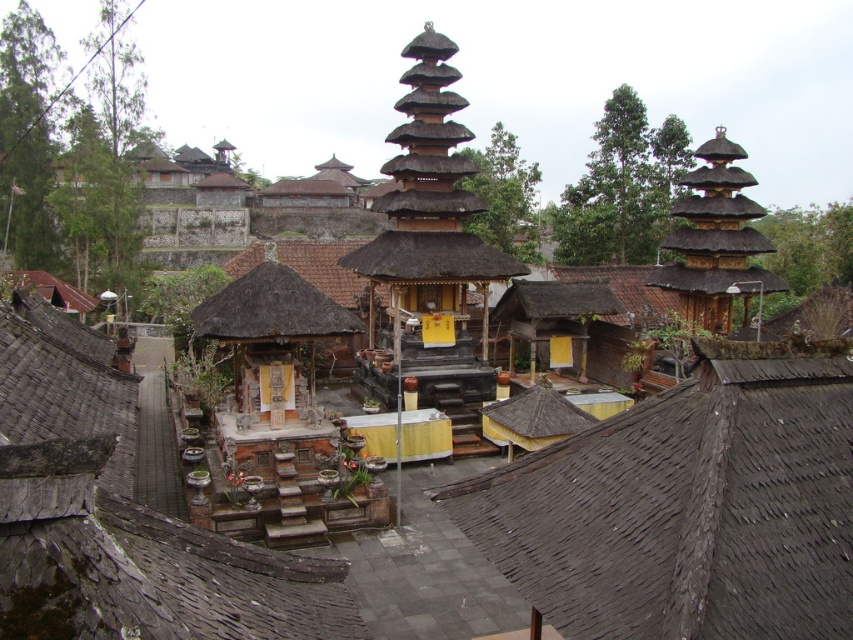
You are standing at the entrance of the temple complex and see the point marked at coordinates (688, 506). Based on the scene description, what architectural feature does this point most likely represent?

The point at coordinates (688, 506) most likely represents the brown thatched roof at center, as indicated by the objects description.

You are a visitor standing at the entrance of the temple complex. You notice the brown thatched roof at center and the thatched wood tower at center. Which of these two structures has a wider base?

The thatched wood tower at center has a wider base than the brown thatched roof at center since the brown thatched roof at center is narrower in width according to the description.

You are a visitor at the temple complex and want to take a photo of the brown thatched roof at center and the thatched wood tower at center. Which one should you zoom in on more to capture both in the frame?

The brown thatched roof at center is smaller than the thatched wood tower at center, so you should zoom in more on the thatched wood tower at center to ensure both fit in the frame.